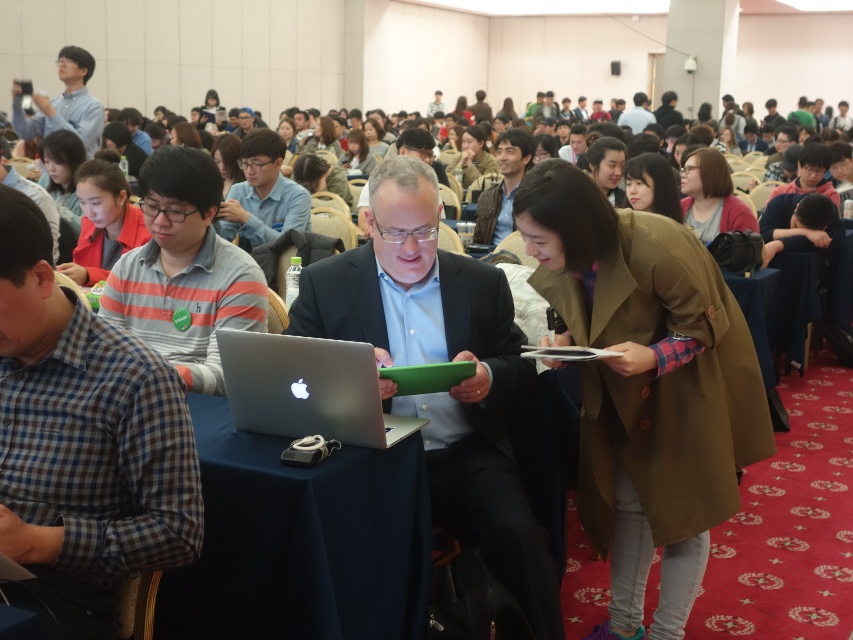
Does plaid shirt at left have a greater height compared to striped cotton polo shirt at center?

Indeed, plaid shirt at left has a greater height compared to striped cotton polo shirt at center.

Is plaid shirt at left further to the viewer compared to striped cotton polo shirt at center?

No, it is in front of striped cotton polo shirt at center.

You are a GUI agent. You are given a task and a screenshot of the screen. Output one action in this format:
    pyautogui.click(x=<x>, y=<y>)
    Task: Click on the plaid shirt at left
    The image size is (853, 640).
    Given the screenshot: What is the action you would take?
    pyautogui.click(x=83, y=442)

Can you confirm if silver metallic laptop at center is positioned to the right of matte black jacket at upper center?

In fact, silver metallic laptop at center is to the left of matte black jacket at upper center.

Where is `silver metallic laptop at center`? silver metallic laptop at center is located at coordinates [x=306, y=388].

Is point (65, 61) closer to camera compared to point (636, 122)?

Yes, point (65, 61) is closer to viewer.

Image resolution: width=853 pixels, height=640 pixels. What do you see at coordinates (67, 104) in the screenshot? I see `matte blue shirt at upper left` at bounding box center [67, 104].

Between point (83, 106) and point (639, 122), which one is positioned in front?

Point (83, 106)

In order to click on matte blue shirt at upper left in this screenshot , I will do point(67,104).